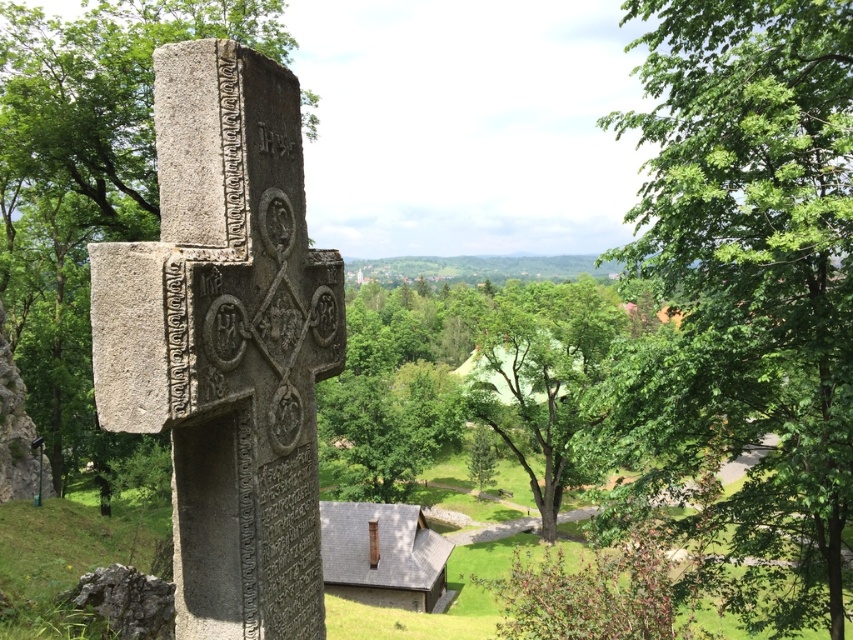
Question: Is green leafy tree at center wider than green stone cross at center?

Choices:
 (A) no
 (B) yes

Answer: (A)

Question: Can you confirm if green leafy tree at center is wider than green stone cross at center?

Choices:
 (A) no
 (B) yes

Answer: (A)

Question: Which point is closer to the camera?

Choices:
 (A) green stone cross at center
 (B) green leafy tree at center

Answer: (A)

Question: Can you confirm if green leafy tree at center is thinner than green stone cross at center?

Choices:
 (A) no
 (B) yes

Answer: (B)